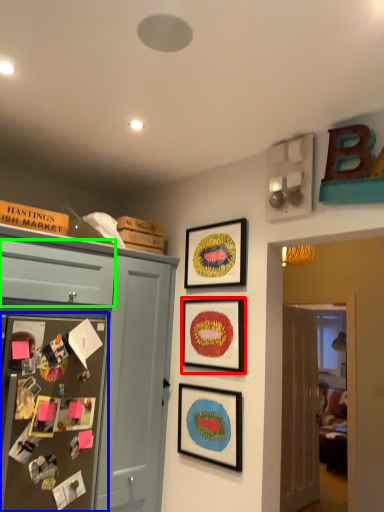
Question: Considering the real-world distances, which object is farthest from picture frame (highlighted by a red box)? bulletin board (highlighted by a blue box) or drawer (highlighted by a green box)?

Choices:
 (A) bulletin board
 (B) drawer

Answer: (A)